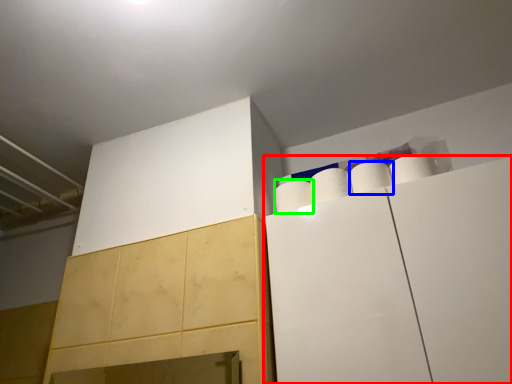
Question: Which object is positioned farthest from cabinetry (highlighted by a red box)? Select from paper towel (highlighted by a blue box) and paper towel (highlighted by a green box).

Choices:
 (A) paper towel
 (B) paper towel

Answer: (B)